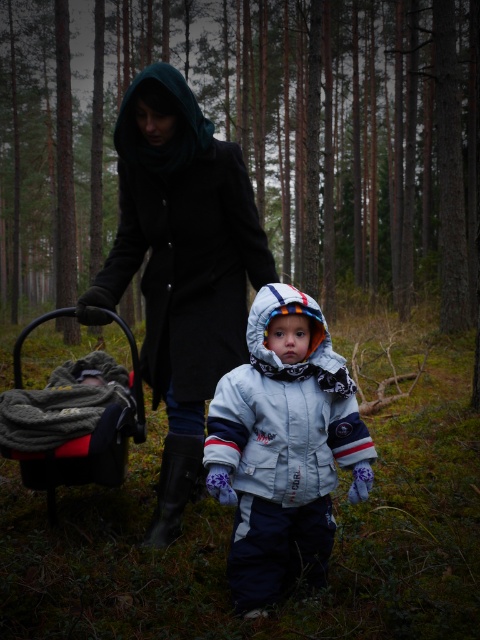
Which is more to the left, green matte pine forest at center or matte black coat at center?

From the viewer's perspective, green matte pine forest at center appears more on the left side.

Does green matte pine forest at center appear over matte black coat at center?

Yes, green matte pine forest at center is above matte black coat at center.

This screenshot has width=480, height=640. What do you see at coordinates (321, 132) in the screenshot? I see `green matte pine forest at center` at bounding box center [321, 132].

Locate an element on the screen. green matte pine forest at center is located at coordinates (321, 132).

Which is in front, point (411, 67) or point (263, 326)?

Point (263, 326) is in front.

Can you confirm if green matte pine forest at center is taller than light gray fleece snowsuit at center?

Yes.

Locate an element on the screen. This screenshot has height=640, width=480. green matte pine forest at center is located at coordinates (321, 132).

I want to click on green matte pine forest at center, so click(321, 132).

Is matte black coat at center below dark gray fabric baby carriage at lower left?

Actually, matte black coat at center is above dark gray fabric baby carriage at lower left.

Which is in front, point (238, 340) or point (58, 476)?

Positioned in front is point (58, 476).

Which is behind, point (120, 147) or point (51, 481)?

The point (51, 481) is behind.

Where is `matte black coat at center`? matte black coat at center is located at coordinates (180, 266).